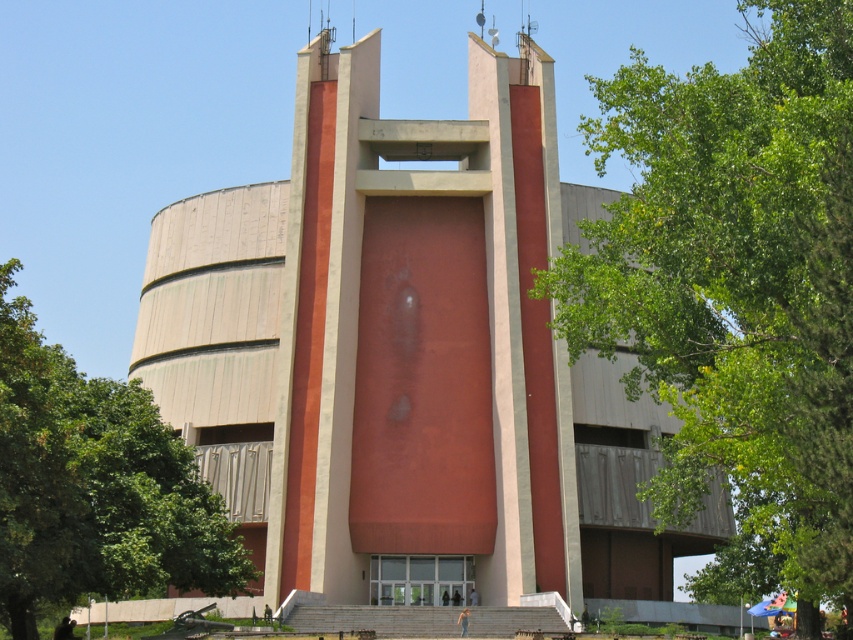
Question: Considering the relative positions of green leafy tree at center and green leafy tree at left in the image provided, where is green leafy tree at center located with respect to green leafy tree at left?

Choices:
 (A) above
 (B) below

Answer: (A)

Question: Is green leafy tree at center to the right of green leafy tree at left from the viewer's perspective?

Choices:
 (A) yes
 (B) no

Answer: (A)

Question: Is green leafy tree at center above green leafy tree at left?

Choices:
 (A) yes
 (B) no

Answer: (A)